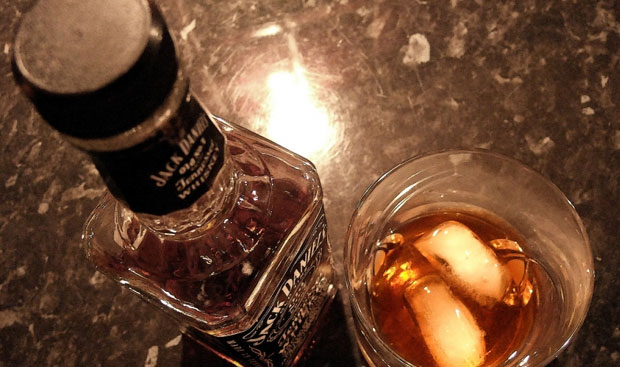
Locate an element on the screen. table is located at coordinates (423, 66).